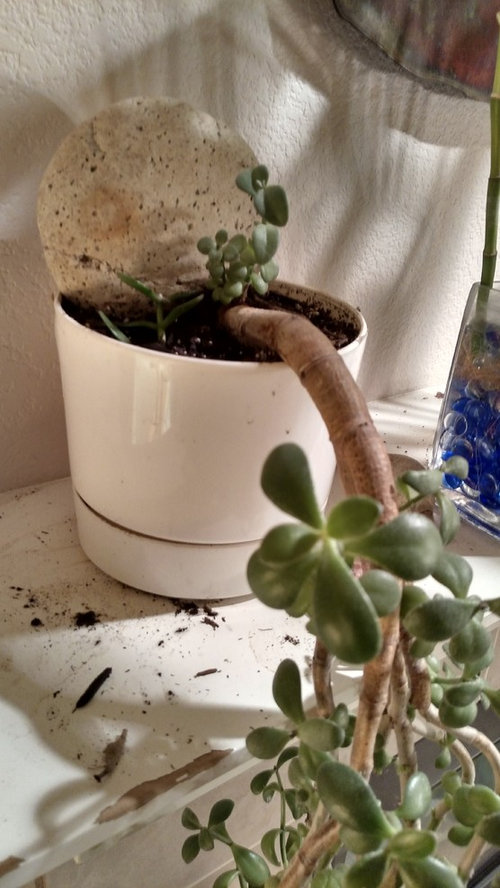
The width and height of the screenshot is (500, 888). What are the coordinates of `white pot` in the screenshot? It's located at (196, 406).